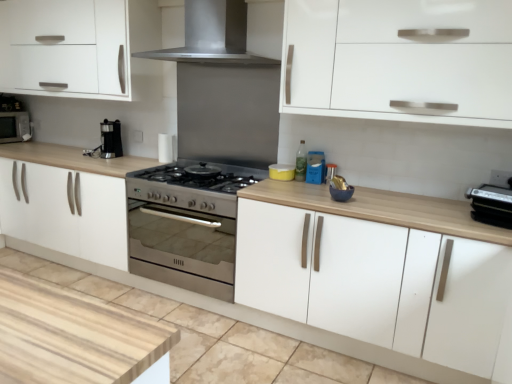
Identify the location of vacant space positioned to the left of black plastic toaster at right, positioned as the third appliance in left-to-right order. The height and width of the screenshot is (384, 512). (423, 210).